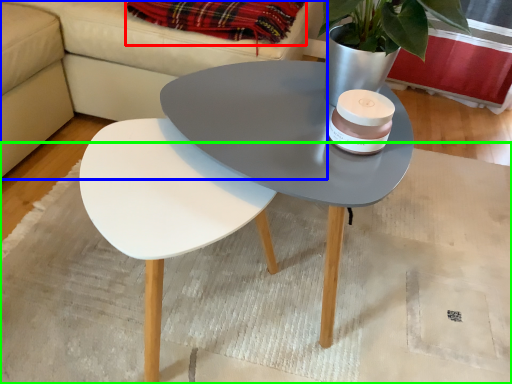
Question: Which object is positioned farthest from blanket (highlighted by a red box)? Select from couch (highlighted by a blue box) and mat (highlighted by a green box).

Choices:
 (A) couch
 (B) mat

Answer: (B)